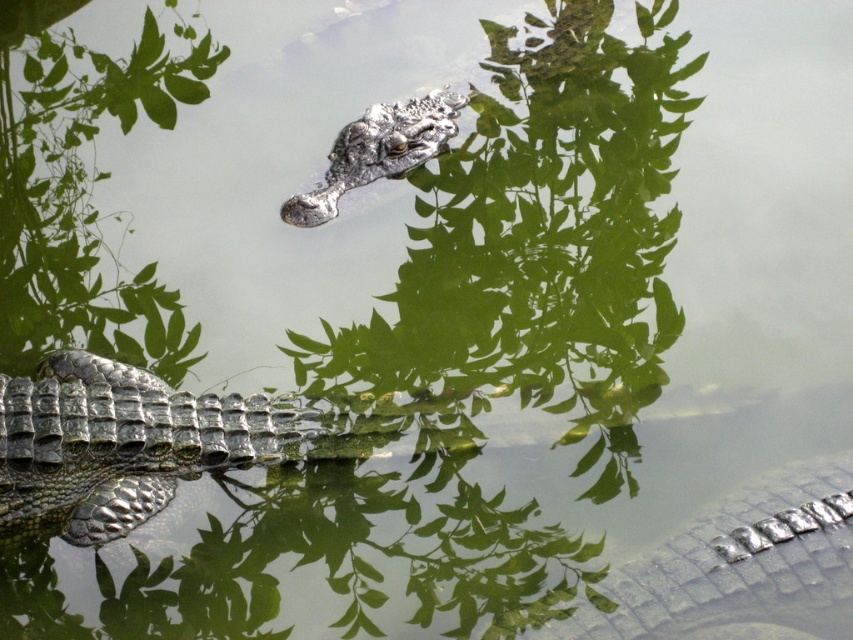
Does green scaly crocodile at lower left have a larger size compared to shiny metallic crocodile at center?

Actually, green scaly crocodile at lower left might be smaller than shiny metallic crocodile at center.

Can you confirm if green scaly crocodile at lower left is taller than shiny metallic crocodile at center?

Incorrect, green scaly crocodile at lower left's height is not larger of shiny metallic crocodile at center's.

At what (x,y) coordinates should I click in order to perform the action: click on green scaly crocodile at lower left. Please return your answer as a coordinate pair (x, y). The image size is (853, 640). Looking at the image, I should click on (120, 442).

Which is below, green scaly crocodile at lower left or shiny green scales at lower right?

shiny green scales at lower right

Who is shorter, green scaly crocodile at lower left or shiny green scales at lower right?

shiny green scales at lower right is shorter.

Measure the distance between point (70, 353) and camera.

Point (70, 353) and camera are 3.51 meters apart.

At what (x,y) coordinates should I click in order to perform the action: click on green scaly crocodile at lower left. Please return your answer as a coordinate pair (x, y). Image resolution: width=853 pixels, height=640 pixels. Looking at the image, I should click on point(120,442).

Does point (669, 634) come farther from viewer compared to point (408, 113)?

No, it is in front of (408, 113).

Is shiny green scales at lower right positioned in front of shiny metallic crocodile at center?

Yes, shiny green scales at lower right is closer to the viewer.

Between point (773, 502) and point (347, 141), which one is positioned in front?

Point (773, 502)

Where is `shiny green scales at lower right`? The height and width of the screenshot is (640, 853). shiny green scales at lower right is located at coordinates (740, 566).